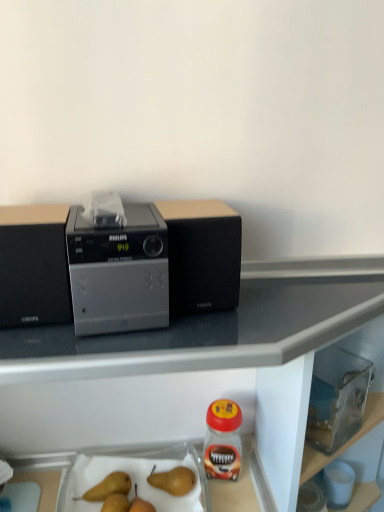
Identify the location of free spot above smooth brown pears at lower center, the 2th fruit when ordered from left to right (from a real-world perspective). The height and width of the screenshot is (512, 384). (133, 497).